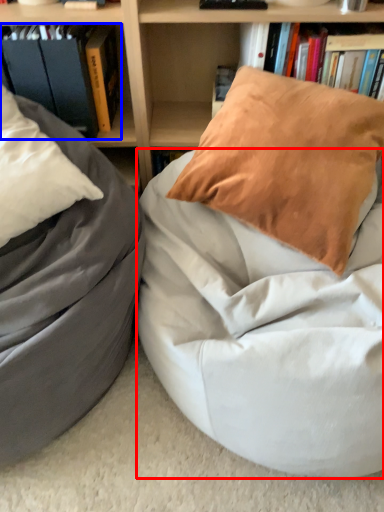
Question: Which of the following is the farthest to the observer, mattress (highlighted by a red box) or book (highlighted by a blue box)?

Choices:
 (A) mattress
 (B) book

Answer: (B)